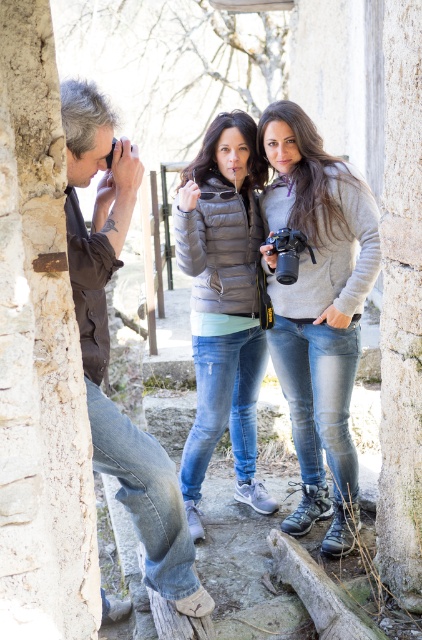
Does black plastic camera at center have a greater width compared to black plastic camera at upper left?

Yes.

Is black plastic camera at center taller than black plastic camera at upper left?

Yes.

Looking at this image, who is more distant from viewer, (x=287, y=284) or (x=110, y=164)?

Point (x=287, y=284)

Where is `black plastic camera at center`? This screenshot has width=422, height=640. black plastic camera at center is located at coordinates (287, 252).

Can you confirm if gray matte sweater at center is positioned above black plastic camera at center?

No.

Which is below, gray matte sweater at center or black plastic camera at center?

gray matte sweater at center is lower down.

Is point (300, 179) less distant than point (286, 241)?

No, it is behind (286, 241).

This screenshot has width=422, height=640. In order to click on gray matte sweater at center in this screenshot , I will do `click(318, 310)`.

Does point (192, 426) come in front of point (107, 163)?

No.

Is matte gray puffer jacket at center further to the viewer compared to black plastic camera at upper left?

Yes, matte gray puffer jacket at center is further from the viewer.

Where is `matte gray puffer jacket at center`? matte gray puffer jacket at center is located at coordinates (222, 305).